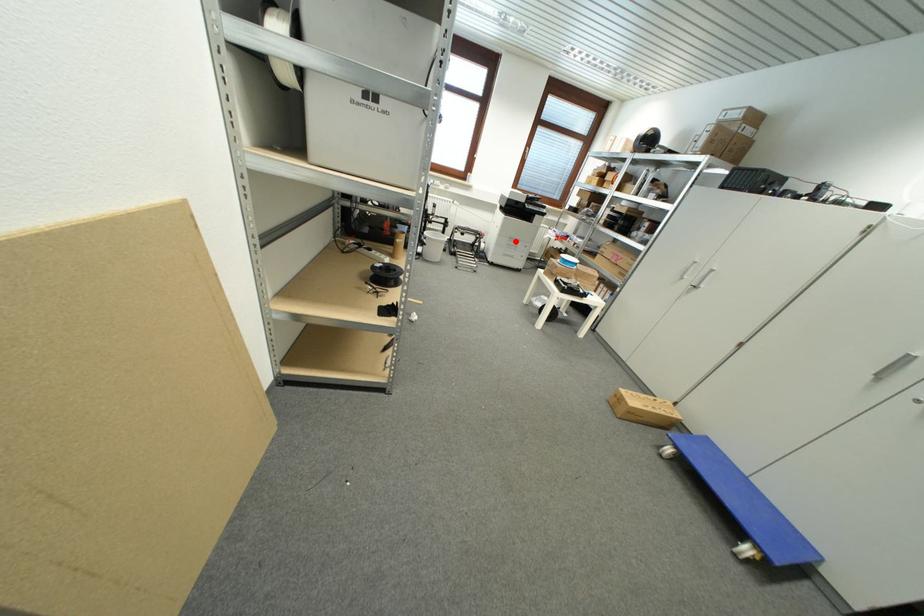
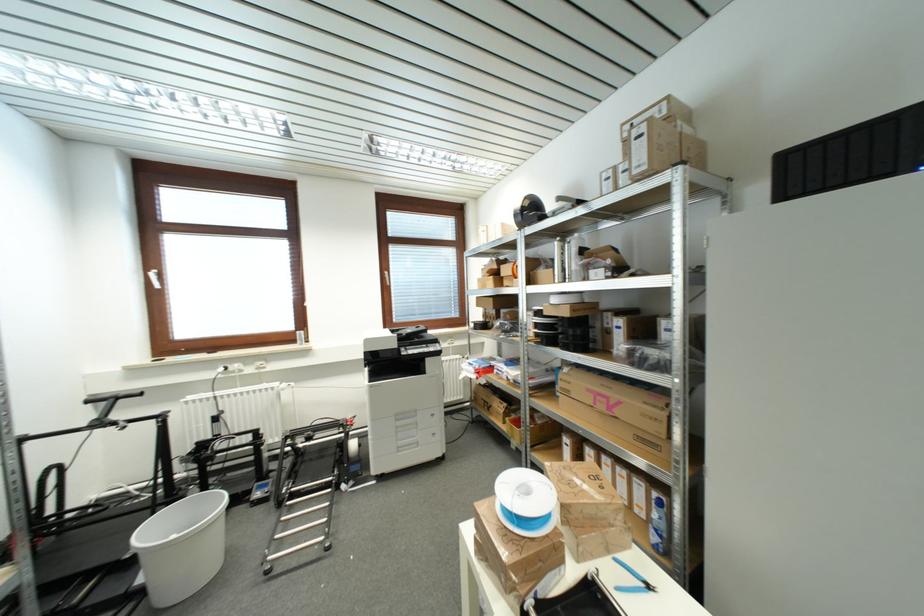
Locate, in the second image, the point that corresponds to the highlighted location in the first image.

(403, 419)